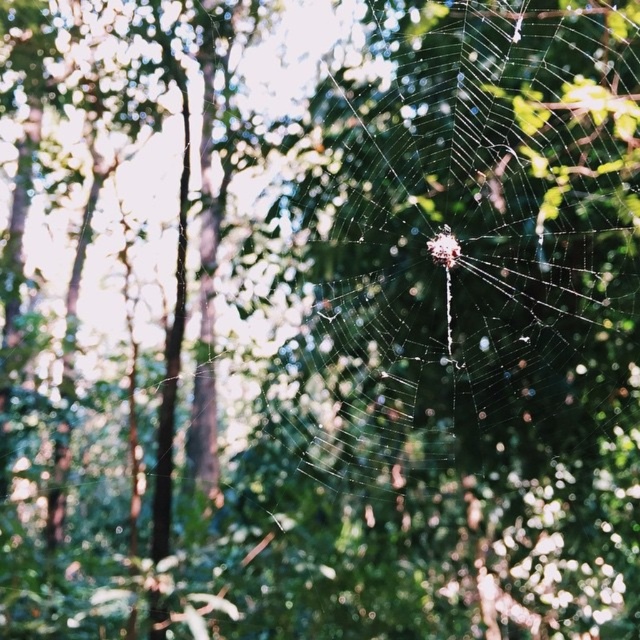
You are a nature photographer aiming to capture the spider web and spider in the forest. Since you want to focus on both the transparent silk spider web at center and the translucent silk spider at center, which one should you adjust your camera focus on first to ensure both are in the frame?

The transparent silk spider web at center is larger in size than the translucent silk spider at center, so you should focus on the spider web first to ensure the smaller spider fits within the frame.

You are an entomologist observing the spider web and spider in the forest. You notice that the transparent silk spider web at center and the translucent silk spider at center are both at the center. Which one has a larger vertical size?

The transparent silk spider web at center has a greater height compared to the translucent silk spider at center, so the transparent silk spider web at center has a larger vertical size.